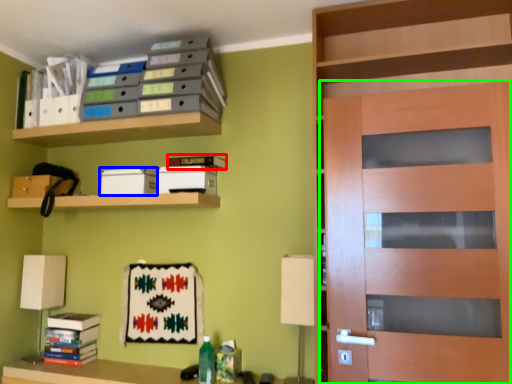
Question: Estimate the real-world distances between objects in this image. Which object is closer to book (highlighted by a red box), storage box (highlighted by a blue box) or door (highlighted by a green box)?

Choices:
 (A) storage box
 (B) door

Answer: (A)